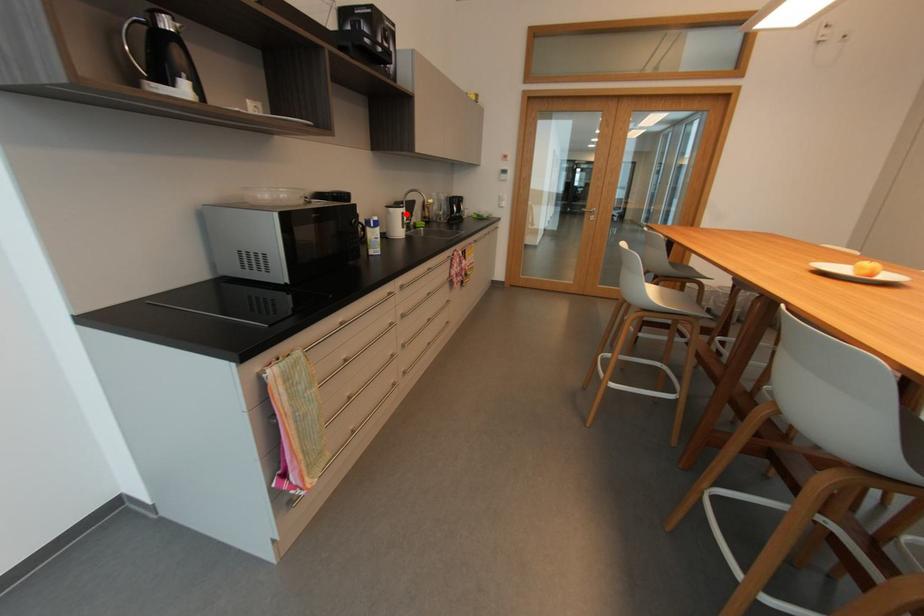
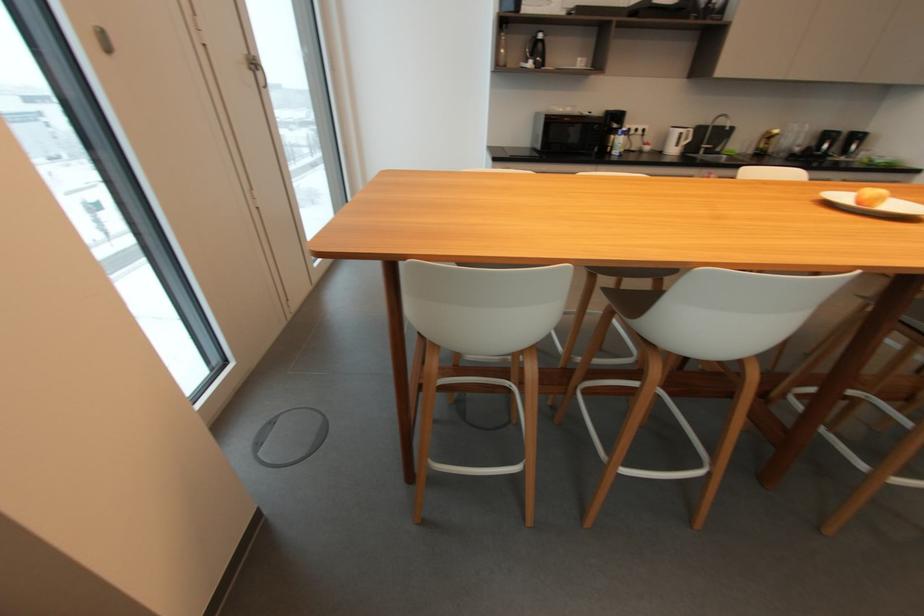
Question: I am providing you with two images of the same scene from different viewpoints. Given a red point in image1, look at the same physical point in image2. Is it:

Choices:
 (A) Closer to the viewpoint
 (B) Farther from the viewpoint

Answer: (B)